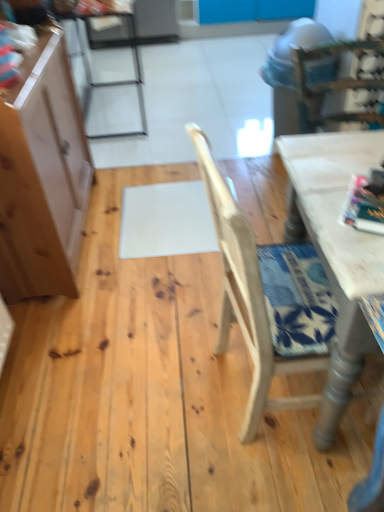
Question: Should I look upward or downward to see light brown wood cabinet at left?

Choices:
 (A) down
 (B) up

Answer: (B)

Question: Is light brown wood chair at center, the first chair viewed from the right, bigger than metallic silver chair at upper left, the 2th chair when ordered from front to back?

Choices:
 (A) no
 (B) yes

Answer: (A)

Question: Would you say light brown wood chair at center, acting as the second chair starting from the back, contains metallic silver chair at upper left, the 1th chair in the left-to-right sequence?

Choices:
 (A) no
 (B) yes

Answer: (A)

Question: Does light brown wood chair at center, which appears as the second chair when viewed from the left, have a greater height compared to metallic silver chair at upper left, which is the 2th chair in right-to-left order?

Choices:
 (A) yes
 (B) no

Answer: (A)

Question: Would you say light brown wood chair at center, which appears as the second chair when viewed from the left, is outside metallic silver chair at upper left, which is the 1th chair from back to front?

Choices:
 (A) no
 (B) yes

Answer: (B)

Question: Would you say light brown wood chair at center, the first chair viewed from the right, is a long distance from metallic silver chair at upper left, positioned as the first chair in top-to-bottom order?

Choices:
 (A) no
 (B) yes

Answer: (B)

Question: Is the depth of light brown wood chair at center, acting as the second chair starting from the back, less than that of metallic silver chair at upper left, positioned as the first chair in top-to-bottom order?

Choices:
 (A) yes
 (B) no

Answer: (A)

Question: Is light brown wood chair at center, placed as the 1th chair when sorted from front to back, at the back of white painted wood table at right?

Choices:
 (A) yes
 (B) no

Answer: (A)

Question: Is white painted wood table at right aimed at light brown wood chair at center, the second chair positioned from the top?

Choices:
 (A) yes
 (B) no

Answer: (A)

Question: Are white painted wood table at right and light brown wood chair at center, placed as the 1th chair when sorted from front to back, beside each other?

Choices:
 (A) no
 (B) yes

Answer: (A)

Question: Is the depth of white painted wood table at right less than that of light brown wood chair at center, the second chair positioned from the top?

Choices:
 (A) no
 (B) yes

Answer: (A)

Question: Does white painted wood table at right have a lesser width compared to light brown wood chair at center, placed as the 1th chair when sorted from front to back?

Choices:
 (A) yes
 (B) no

Answer: (A)

Question: Are white painted wood table at right and light brown wood chair at center, which is the first chair from bottom to top, located far from each other?

Choices:
 (A) no
 (B) yes

Answer: (A)

Question: Does metallic silver chair at upper left, the 2th chair when ordered from front to back, have a lesser height compared to white painted wood table at right?

Choices:
 (A) no
 (B) yes

Answer: (A)